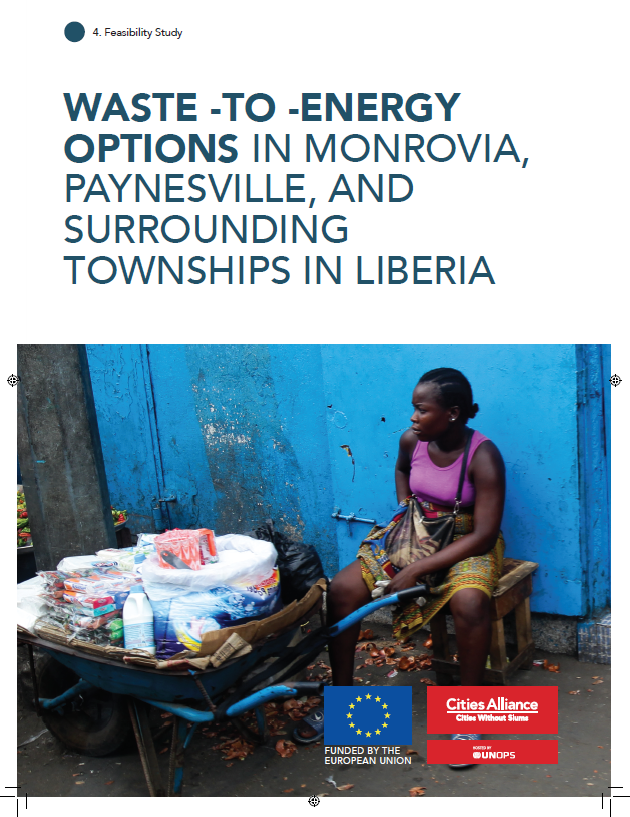
Image resolution: width=630 pixels, height=817 pixels. In order to click on the right handle in this screenshot , I will do `click(409, 592)`.